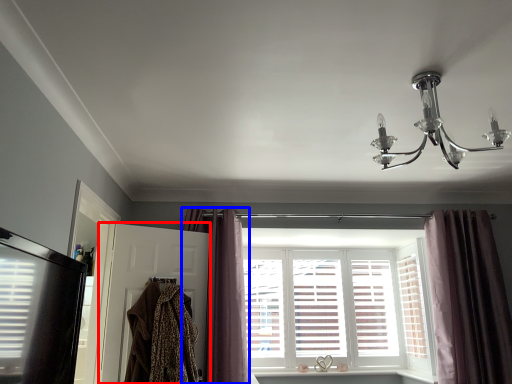
Question: Which object appears farthest to the camera in this image, screen door (highlighted by a red box) or curtain (highlighted by a blue box)?

Choices:
 (A) screen door
 (B) curtain

Answer: (B)